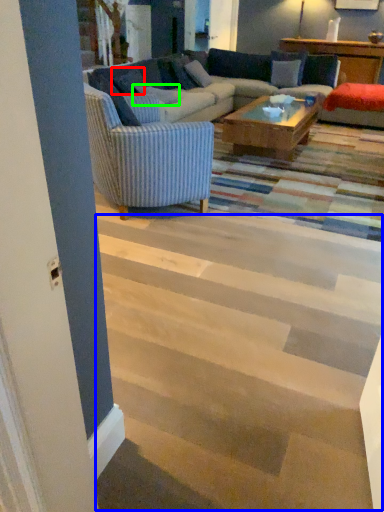
Question: Estimate the real-world distances between objects in this image. Which object is farther from pillow (highlighted by a red box), stairwell (highlighted by a blue box) or pillow (highlighted by a green box)?

Choices:
 (A) stairwell
 (B) pillow

Answer: (A)